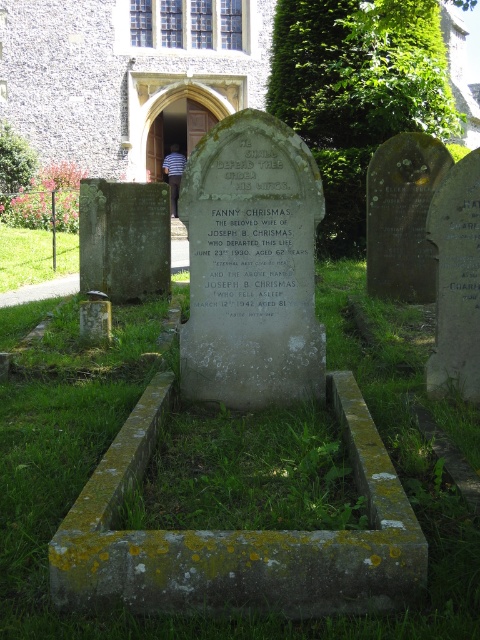
Question: Is green mossy grass at center wider than green grass at lower left?

Choices:
 (A) yes
 (B) no

Answer: (B)

Question: Which point is closer to the camera?

Choices:
 (A) green mossy grass at center
 (B) green grass at lower left

Answer: (A)

Question: Observing the image, what is the correct spatial positioning of green mossy grass at center in reference to green grass at lower left?

Choices:
 (A) below
 (B) above

Answer: (A)

Question: Which point is closer to the camera?

Choices:
 (A) (64, 252)
 (B) (336, 340)

Answer: (B)

Question: Does green mossy grass at center have a lesser width compared to green grass at lower left?

Choices:
 (A) yes
 (B) no

Answer: (A)